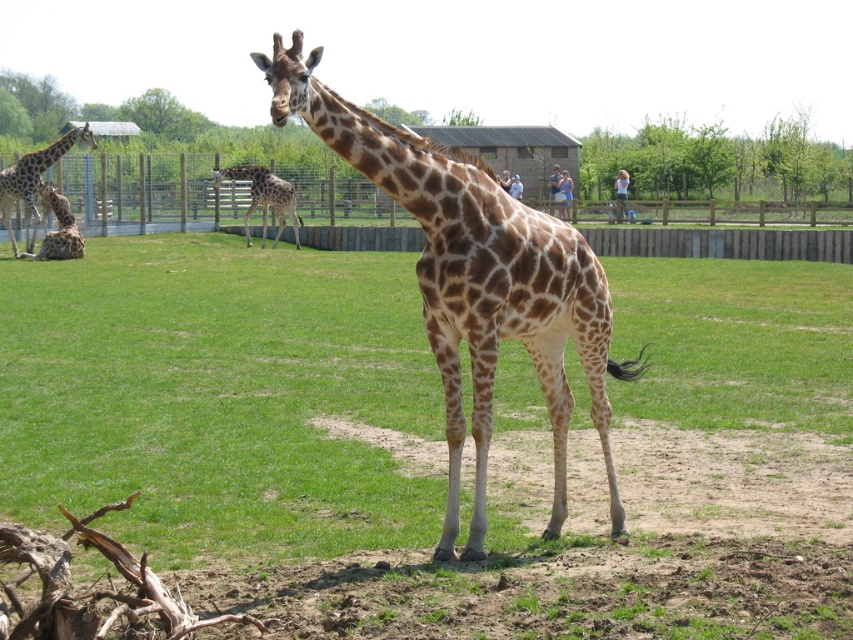
Who is shorter, brown spotted giraffe at left or spotted fur giraffe at center?

spotted fur giraffe at center is shorter.

Does brown spotted giraffe at left appear under spotted fur giraffe at center?

Actually, brown spotted giraffe at left is above spotted fur giraffe at center.

Is point (16, 170) positioned after point (256, 196)?

No, it is in front of (256, 196).

At what (x,y) coordinates should I click in order to perform the action: click on brown spotted giraffe at left. Please return your answer as a coordinate pair (x, y). The width and height of the screenshot is (853, 640). Looking at the image, I should click on (33, 182).

Is point (48, 145) positioned before point (55, 234)?

No, it is behind (55, 234).

Between brown spotted giraffe at left and brown spotted giraffe at lower left, which one appears on the left side from the viewer's perspective?

Positioned to the left is brown spotted giraffe at left.

Who is more distant from viewer, (56, 145) or (44, 221)?

The point (44, 221) is more distant.

Locate an element on the screen. brown spotted giraffe at left is located at coordinates (33, 182).

Can you confirm if brown spotted giraffe at center is positioned above brown spotted giraffe at lower left?

No.

Is brown spotted giraffe at center to the right of brown spotted giraffe at lower left from the viewer's perspective?

Indeed, brown spotted giraffe at center is positioned on the right side of brown spotted giraffe at lower left.

Is point (589, 364) closer to camera compared to point (77, 253)?

Yes, it is in front of point (77, 253).

Identify the location of brown spotted giraffe at center. (474, 282).